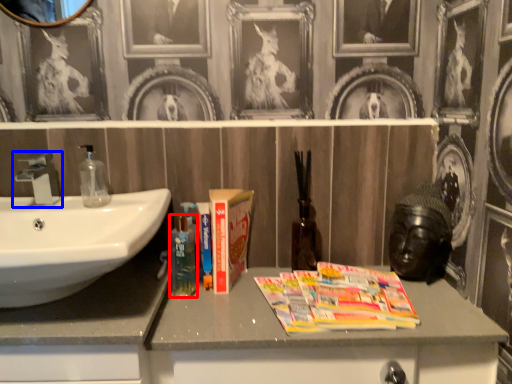
Question: Which object appears farthest to the camera in this image, mouthwash (highlighted by a red box) or tap (highlighted by a blue box)?

Choices:
 (A) mouthwash
 (B) tap

Answer: (A)